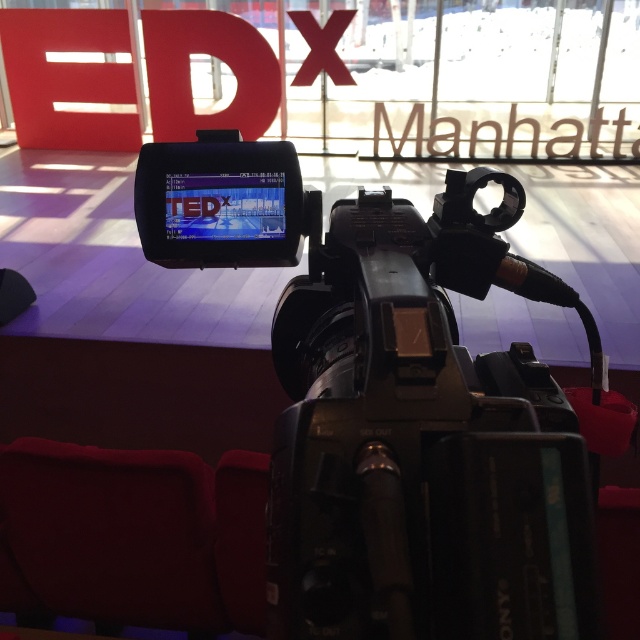
Question: Considering the relative positions of black plastic video camera at center and velvet red chair at lower left in the image provided, where is black plastic video camera at center located with respect to velvet red chair at lower left?

Choices:
 (A) left
 (B) right

Answer: (B)

Question: Can you confirm if black plastic video camera at center is positioned to the left of velvet red chair at lower left?

Choices:
 (A) no
 (B) yes

Answer: (A)

Question: Which object appears closest to the camera in this image?

Choices:
 (A) black plastic video camera at center
 (B) velvet red chair at lower left

Answer: (A)

Question: Which point is farther from the camera taking this photo?

Choices:
 (A) (467, 275)
 (B) (40, 500)

Answer: (B)

Question: Considering the relative positions of black plastic video camera at center and velvet red chair at lower left in the image provided, where is black plastic video camera at center located with respect to velvet red chair at lower left?

Choices:
 (A) below
 (B) above

Answer: (B)

Question: Which of the following is the closest to the observer?

Choices:
 (A) black plastic video camera at center
 (B) velvet red chair at lower left

Answer: (A)